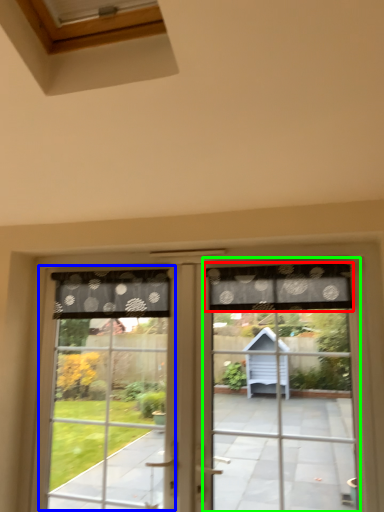
Question: Considering the real-world distances, which object is closest to curtain (highlighted by a red box)? bay window (highlighted by a blue box) or screen door (highlighted by a green box).

Choices:
 (A) bay window
 (B) screen door

Answer: (B)